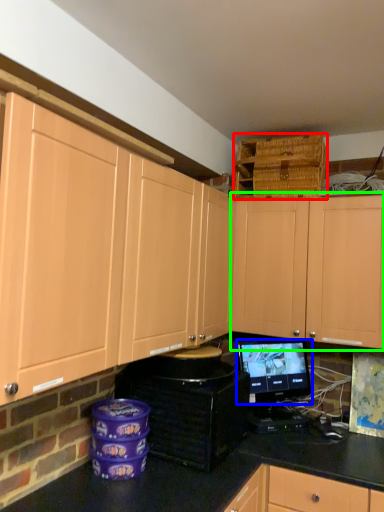
Question: Considering the real-world distances, which object is farthest from basket (highlighted by a red box)? computer monitor (highlighted by a blue box) or cabinetry (highlighted by a green box)?

Choices:
 (A) computer monitor
 (B) cabinetry

Answer: (A)